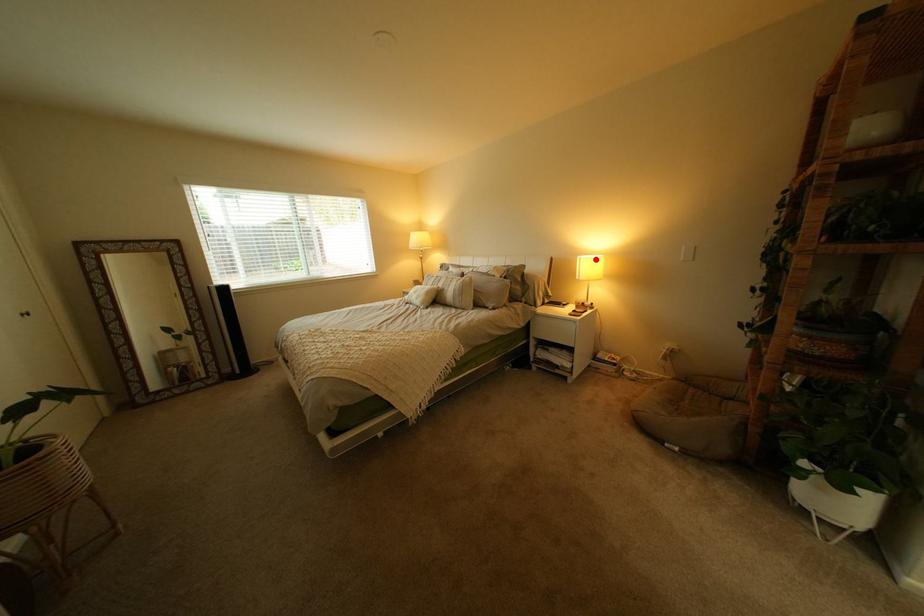
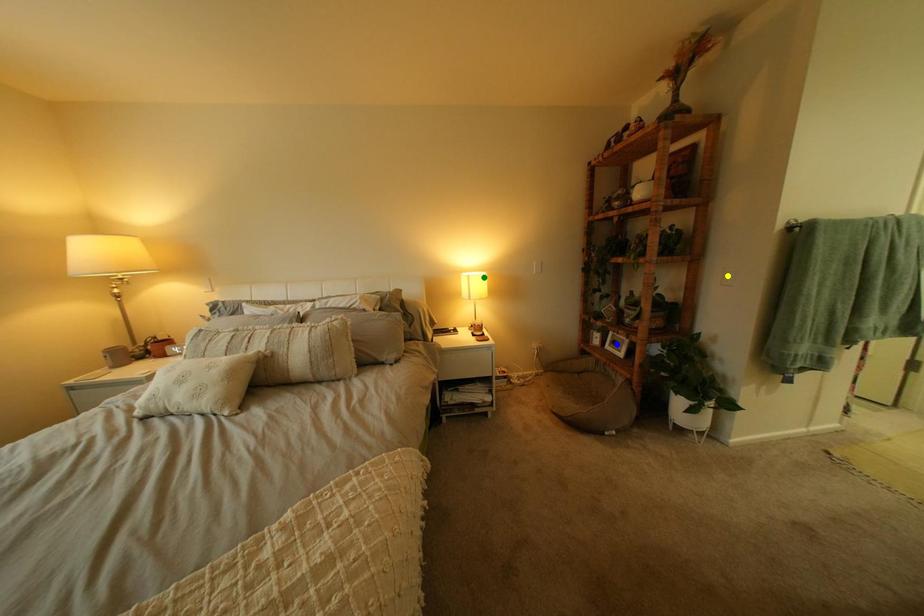
Question: I am providing you with two images of the same scene from different viewpoints. A red point is marked on the first image. You are given multiple points on the second image. Which point in image 2 is actually the same real-world point as the red point in image 1?

Choices:
 (A) green point
 (B) blue point
 (C) yellow point

Answer: (A)